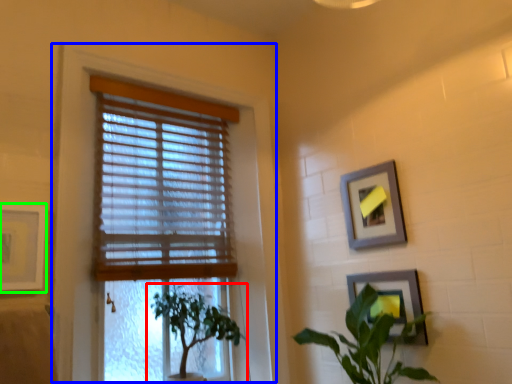
Question: Considering the real-world distances, which object is closest to houseplant (highlighted by a red box)? window frame (highlighted by a blue box) or picture frame (highlighted by a green box).

Choices:
 (A) window frame
 (B) picture frame

Answer: (A)